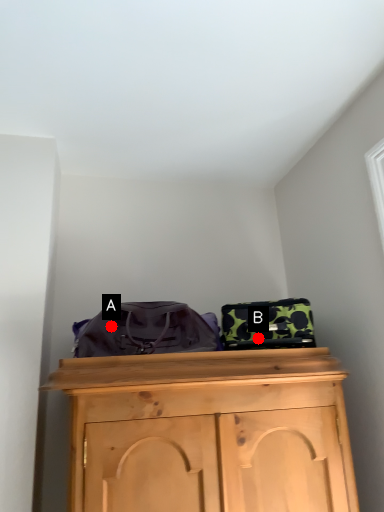
Question: Two points are circled on the image, labeled by A and B beside each circle. Which point is farther to the camera?

Choices:
 (A) A is further
 (B) B is further

Answer: (B)